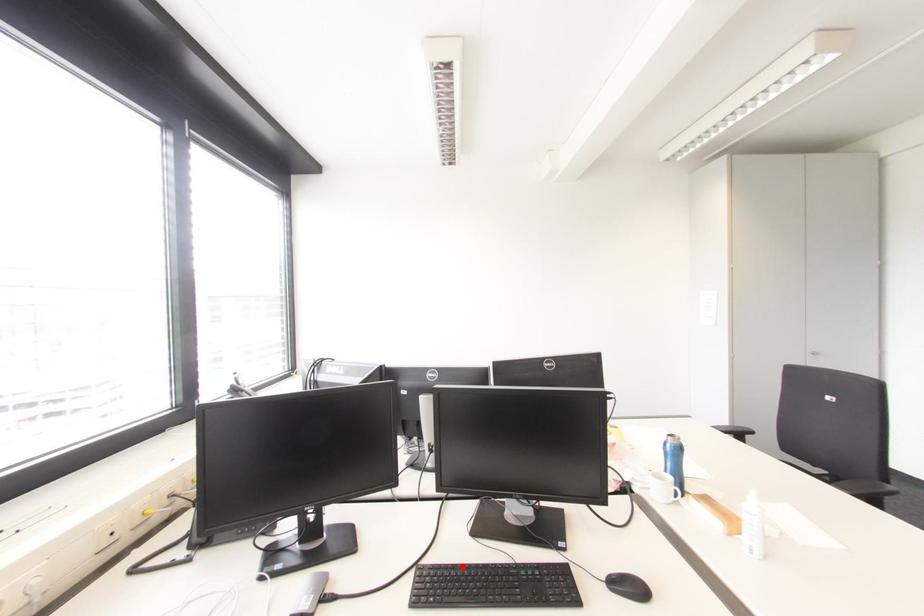
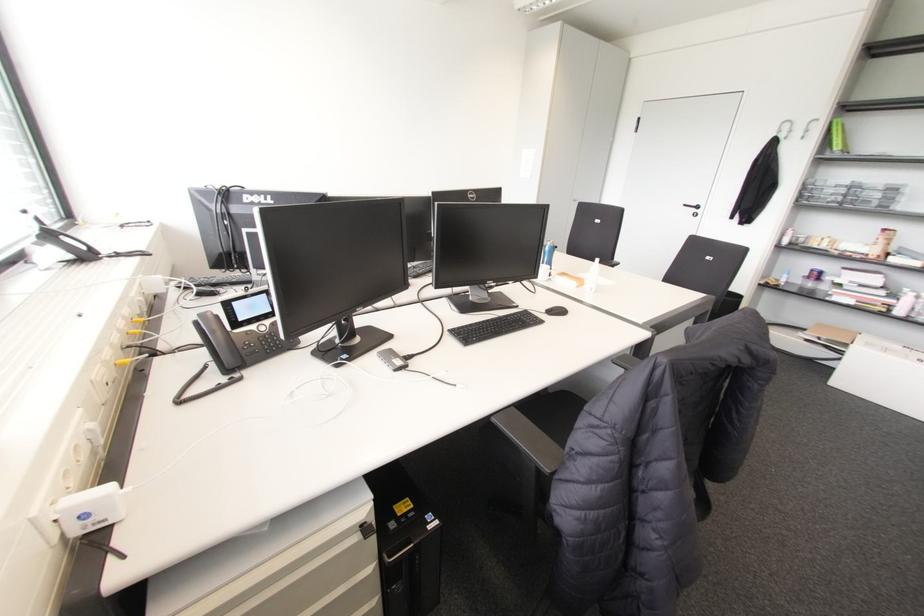
Question: I am providing you with two images of the same scene from different viewpoints. A red point is marked on the first image. Is the red point's position out of view in image 2?

Choices:
 (A) Yes
 (B) No

Answer: (B)